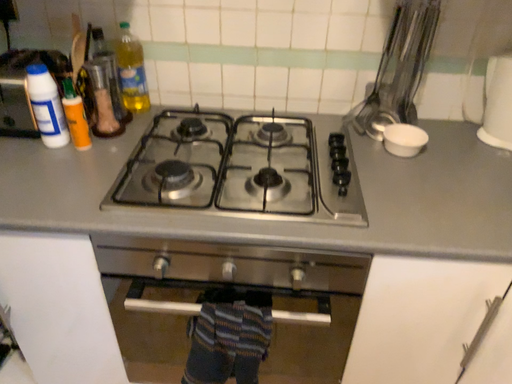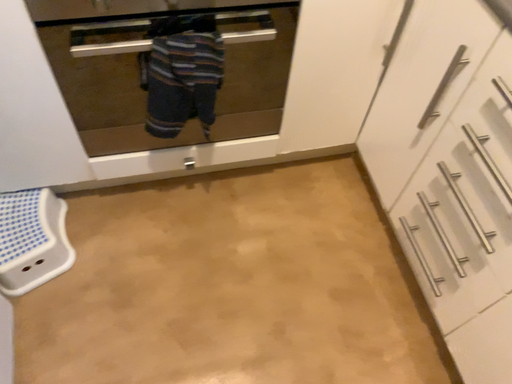
Question: How did the camera likely rotate when shooting the video?

Choices:
 (A) rotated left
 (B) rotated right

Answer: (B)